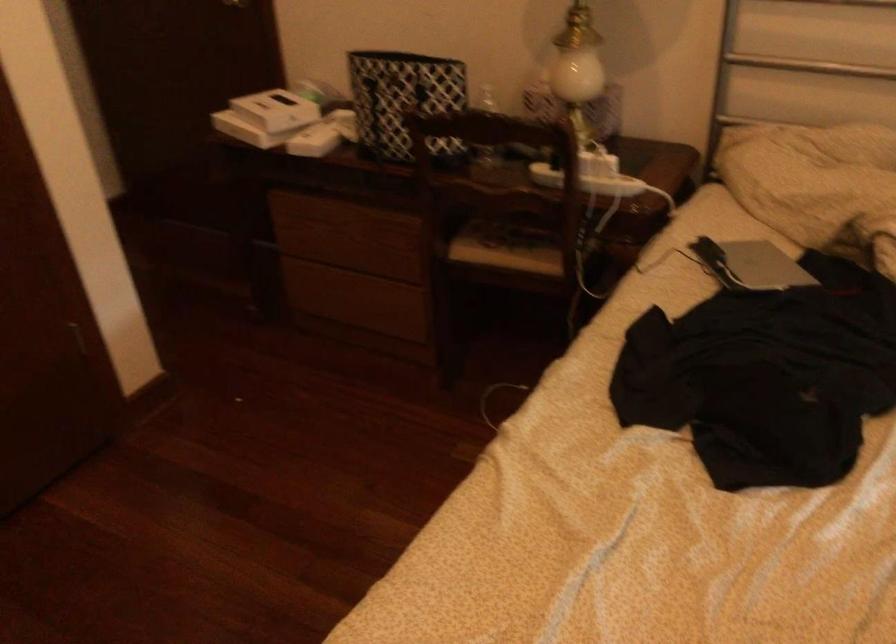
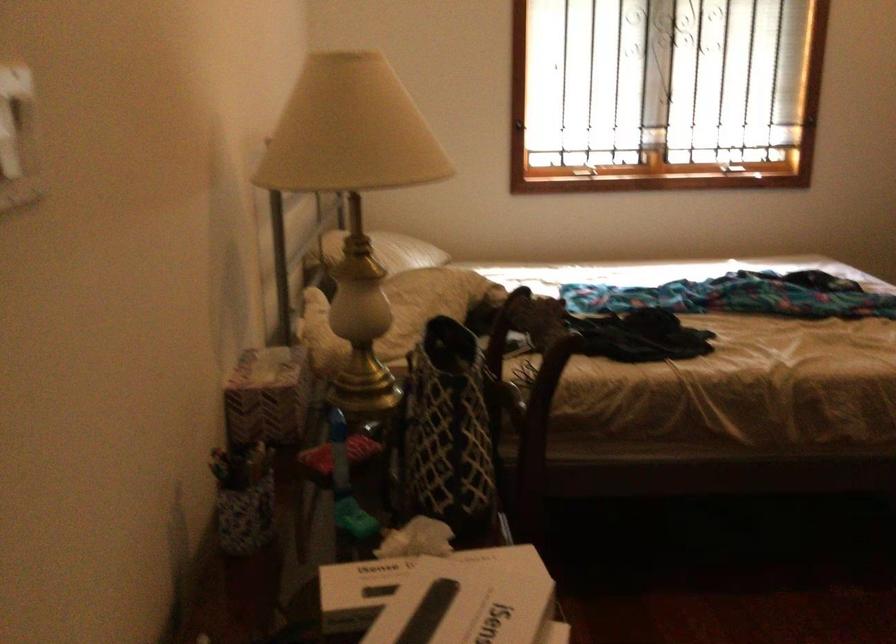
Find the pixel in the second image that matches [305,100] in the first image.

(407, 583)